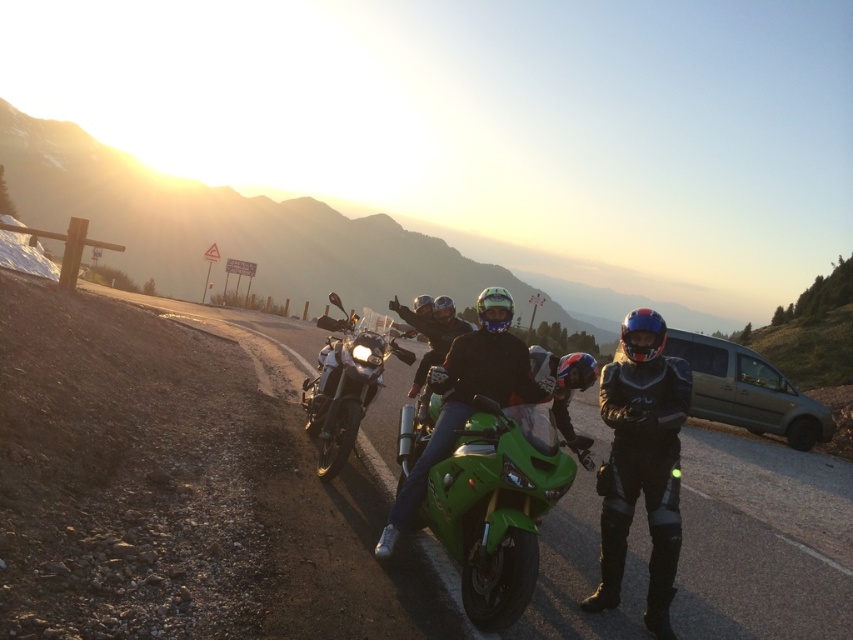
From the picture: You are a photographer planning to take a picture of the green matte motorcycle at center from the road. Given its coordinates at point 0.777, 0.590, would you position yourself closer to the wooden fence on the left or the grassy embankment on the right to ensure the motorcycle is centered in your shot?

To ensure the green matte motorcycle at center is centered in your shot, you should position yourself closer to the wooden fence on the left since the motorcycle is located at point [502,497], which is closer to the left side of the image.

You are a motorcyclist planning to ride the green glossy motorcycle at center. You notice a black leather jacket at center nearby. Can you grab it without leaving the motorcycle seat?

The black leather jacket at center is 3.80 feet away from the green glossy motorcycle at center. Since this distance is greater than an average person can reach while sitting, you cannot grab it without leaving the seat.

You are a motorcycle enthusiast planning to park your motorcycle in this scenic spot. The green matte motorcycle at center is already parked, and you want to place your black leather jacket at center. Considering the space between them, will your jacket fit without touching the motorcycle?

The distance between the green matte motorcycle at center and the black leather jacket at center is 3.39 feet, which is sufficient space to place the jacket without it touching the motorcycle.